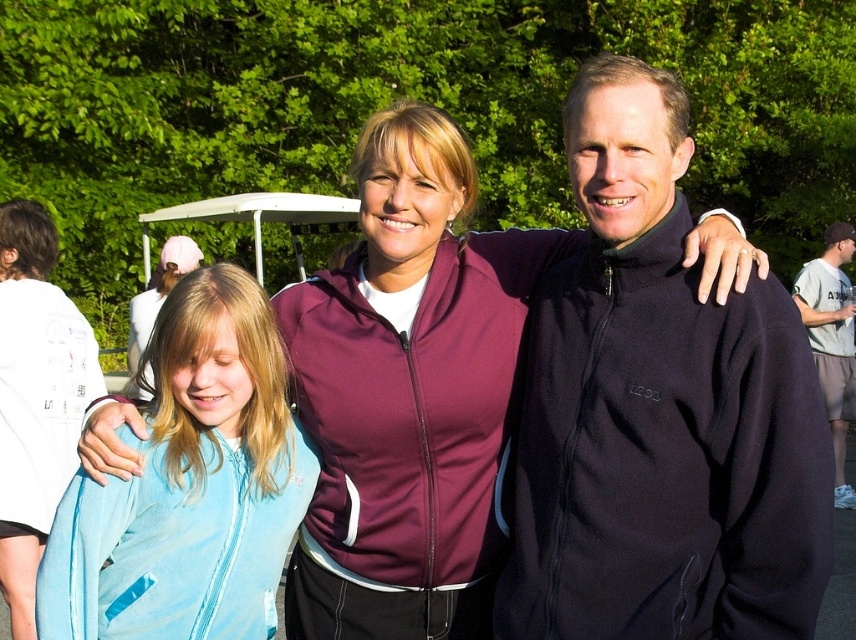
Question: Among these points, which one is farthest from the camera?

Choices:
 (A) (418, 368)
 (B) (767, 540)
 (C) (842, 458)

Answer: (C)

Question: Is black softshell jacket at center above gray cotton t-shirt at right?

Choices:
 (A) yes
 (B) no

Answer: (A)

Question: From the image, what is the correct spatial relationship of black softshell jacket at center in relation to purple softshell jacket at center?

Choices:
 (A) right
 (B) left

Answer: (A)

Question: Is the position of black softshell jacket at center less distant than that of gray cotton t-shirt at right?

Choices:
 (A) no
 (B) yes

Answer: (B)

Question: Which is nearer to the black softshell jacket at center?

Choices:
 (A) purple softshell jacket at center
 (B) light blue fleece jacket at left
 (C) gray cotton t-shirt at right

Answer: (A)

Question: Which of the following is the closest to the observer?

Choices:
 (A) (597, 541)
 (B) (342, 284)

Answer: (A)